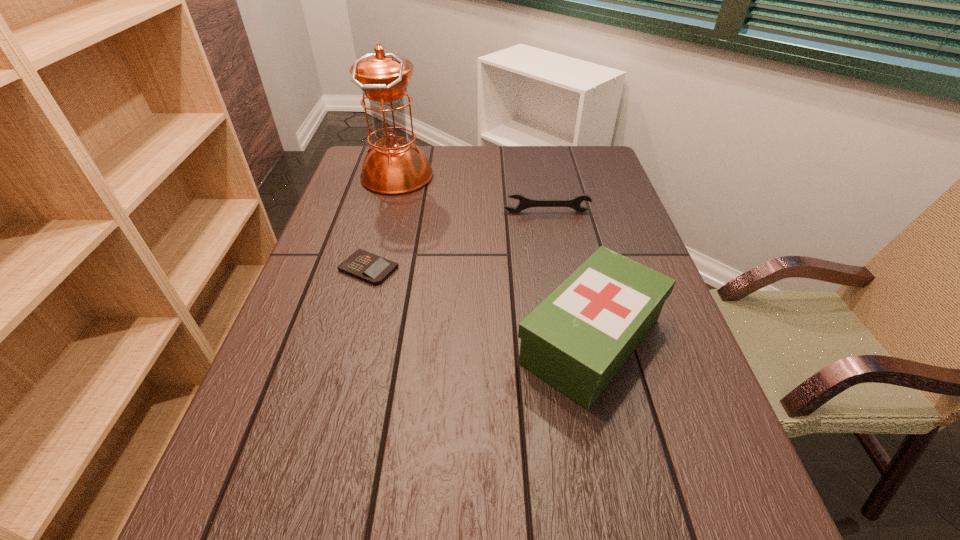
You are a GUI agent. You are given a task and a screenshot of the screen. Output one action in this format:
    pyautogui.click(x=<x>, y=<y>)
    Task: Click on the tallest object
    The width and height of the screenshot is (960, 540).
    Given the screenshot: What is the action you would take?
    pyautogui.click(x=394, y=165)

Identify the location of the farthest object. The height and width of the screenshot is (540, 960). (394, 165).

At what (x,y) coordinates should I click in order to perform the action: click on the first-aid kit. Please return your answer as a coordinate pair (x, y). This screenshot has height=540, width=960. Looking at the image, I should click on (577, 339).

Where is `wrench`? This screenshot has height=540, width=960. wrench is located at coordinates (524, 203).

Identify the location of the third tallest object. The height and width of the screenshot is (540, 960). (524, 203).

Locate an element on the screen. The image size is (960, 540). the shortest object is located at coordinates (366, 266).

This screenshot has height=540, width=960. What are the coordinates of `free space located on the front of the tallest object` in the screenshot? It's located at click(x=372, y=269).

Find the location of a particular element. This screenshot has width=960, height=540. vacant space located on the front of the first-aid kit is located at coordinates 614,440.

You are a GUI agent. You are given a task and a screenshot of the screen. Output one action in this format:
    pyautogui.click(x=<x>, y=<y>)
    Task: Click on the vacant space located on the open ends of the wrench
    Image resolution: width=960 pixels, height=540 pixels.
    Given the screenshot: What is the action you would take?
    pyautogui.click(x=560, y=279)

Where is `vacant space located on the back of the calculator`? vacant space located on the back of the calculator is located at coordinates (386, 207).